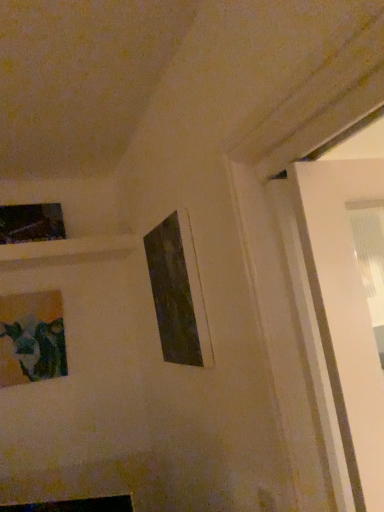
Image resolution: width=384 pixels, height=512 pixels. What are the coordinates of `matte black picture frame at center, placed as the first picture frame when sorted from front to back` in the screenshot? It's located at (178, 292).

What do you see at coordinates (31, 223) in the screenshot? The width and height of the screenshot is (384, 512). I see `matte black picture frame at upper left, acting as the 1th picture frame starting from the back` at bounding box center [31, 223].

In order to face matte black picture frame at upper left, the first picture frame from the left, should I rotate leftwards or rightwards?

Turn left approximately 20.401 degrees to face it.

Find the location of a particular element. matte black picture frame at center, the third picture frame from the back is located at coordinates (178, 292).

From a real-world perspective, who is located higher, matte black picture frame at center, the 3th picture frame positioned from the left, or matte glass picture frame at lower left, the second picture frame from the right?

In real-world perspective, matte black picture frame at center, the 3th picture frame positioned from the left, is above.

In the scene shown: Is matte black picture frame at center, the 3th picture frame positioned from the left, positioned far away from matte glass picture frame at lower left, which is the 2th picture frame from left to right?

No, matte black picture frame at center, the 3th picture frame positioned from the left, is in close proximity to matte glass picture frame at lower left, which is the 2th picture frame from left to right.

In terms of size, does matte black picture frame at center, the first picture frame from the right, appear bigger or smaller than matte glass picture frame at lower left, which is the 2th picture frame from left to right?

In the image, matte black picture frame at center, the first picture frame from the right, appears to be larger than matte glass picture frame at lower left, which is the 2th picture frame from left to right.

Considering the relative positions of matte black picture frame at center, the third picture frame from the back, and matte glass picture frame at lower left, which is the 2th picture frame from left to right, in the image provided, is matte black picture frame at center, the third picture frame from the back, to the left of matte glass picture frame at lower left, which is the 2th picture frame from left to right, from the viewer's perspective?

No.

Is matte black picture frame at upper left, the third picture frame positioned from the front, smaller than matte black picture frame at center, the third picture frame from the back?

Indeed, matte black picture frame at upper left, the third picture frame positioned from the front, has a smaller size compared to matte black picture frame at center, the third picture frame from the back.

Considering the positions of objects matte black picture frame at upper left, acting as the 1th picture frame starting from the back, and matte black picture frame at center, the 3th picture frame positioned from the left, in the image provided, who is more to the right, matte black picture frame at upper left, acting as the 1th picture frame starting from the back, or matte black picture frame at center, the 3th picture frame positioned from the left,?

Positioned to the right is matte black picture frame at center, the 3th picture frame positioned from the left.

Can you tell me how much matte black picture frame at upper left, the first picture frame from the left, and matte black picture frame at center, placed as the first picture frame when sorted from front to back, differ in facing direction?

90.5 degrees separate the facing orientations of matte black picture frame at upper left, the first picture frame from the left, and matte black picture frame at center, placed as the first picture frame when sorted from front to back.

From a real-world perspective, which object rests below the other?

matte black picture frame at center, placed as the first picture frame when sorted from front to back.

Between matte glass picture frame at lower left, which is the 2th picture frame from left to right, and matte black picture frame at upper left, which is the 3th picture frame in right-to-left order, which one has larger width?

matte black picture frame at upper left, which is the 3th picture frame in right-to-left order, is wider.

Is matte glass picture frame at lower left, which is the 2th picture frame from left to right, positioned beyond the bounds of matte black picture frame at upper left, acting as the 1th picture frame starting from the back?

Absolutely, matte glass picture frame at lower left, which is the 2th picture frame from left to right, is external to matte black picture frame at upper left, acting as the 1th picture frame starting from the back.

Does matte glass picture frame at lower left, acting as the second picture frame starting from the back, lie behind matte black picture frame at upper left, which is the 3th picture frame in right-to-left order?

That is False.

Based on their sizes in the image, would you say matte glass picture frame at lower left, the second picture frame from the right, is bigger or smaller than matte black picture frame at upper left, the third picture frame positioned from the front?

matte glass picture frame at lower left, the second picture frame from the right, is bigger than matte black picture frame at upper left, the third picture frame positioned from the front.

Between matte black picture frame at upper left, the third picture frame positioned from the front, and matte glass picture frame at lower left, the second picture frame from the right, which one has larger size?

With larger size is matte glass picture frame at lower left, the second picture frame from the right.

Is matte black picture frame at upper left, the third picture frame positioned from the front, oriented towards matte glass picture frame at lower left, which is counted as the second picture frame, starting from the front?

No, matte black picture frame at upper left, the third picture frame positioned from the front, is not turned towards matte glass picture frame at lower left, which is counted as the second picture frame, starting from the front.

Considering the sizes of matte black picture frame at upper left, the first picture frame from the left, and matte glass picture frame at lower left, which is the 2th picture frame from left to right, in the image, is matte black picture frame at upper left, the first picture frame from the left, taller or shorter than matte glass picture frame at lower left, which is the 2th picture frame from left to right,?

Considering their sizes, matte black picture frame at upper left, the first picture frame from the left, has less height than matte glass picture frame at lower left, which is the 2th picture frame from left to right.

Does matte black picture frame at upper left, the third picture frame positioned from the front, come in front of matte glass picture frame at lower left, the second picture frame from the right?

No, matte black picture frame at upper left, the third picture frame positioned from the front, is further to the viewer.

Between matte glass picture frame at lower left, the second picture frame from the right, and matte black picture frame at center, the third picture frame from the back, which one has smaller width?

Thinner between the two is matte black picture frame at center, the third picture frame from the back.

From the image's perspective, who appears lower, matte glass picture frame at lower left, the second picture frame from the right, or matte black picture frame at center, the 3th picture frame positioned from the left?

matte glass picture frame at lower left, the second picture frame from the right.

Which object is closer to the camera taking this photo, matte glass picture frame at lower left, which is counted as the second picture frame, starting from the front, or matte black picture frame at center, placed as the first picture frame when sorted from front to back?

matte black picture frame at center, placed as the first picture frame when sorted from front to back.

Does matte glass picture frame at lower left, which is the 2th picture frame from left to right, appear on the right side of matte black picture frame at center, the 3th picture frame positioned from the left?

In fact, matte glass picture frame at lower left, which is the 2th picture frame from left to right, is to the left of matte black picture frame at center, the 3th picture frame positioned from the left.

Can you confirm if matte black picture frame at center, the third picture frame from the back, is bigger than matte black picture frame at upper left, acting as the 1th picture frame starting from the back?

Correct, matte black picture frame at center, the third picture frame from the back, is larger in size than matte black picture frame at upper left, acting as the 1th picture frame starting from the back.

Is matte black picture frame at center, the 3th picture frame positioned from the left, further to camera compared to matte black picture frame at upper left, the third picture frame positioned from the front?

No, matte black picture frame at center, the 3th picture frame positioned from the left, is closer to the viewer.

Is matte black picture frame at upper left, the first picture frame from the left, at the back of matte black picture frame at center, the 3th picture frame positioned from the left?

matte black picture frame at center, the 3th picture frame positioned from the left, is not turned away from matte black picture frame at upper left, the first picture frame from the left.

Who is taller, matte black picture frame at center, the 3th picture frame positioned from the left, or matte black picture frame at upper left, the third picture frame positioned from the front?

matte black picture frame at center, the 3th picture frame positioned from the left, is taller.

Locate an element on the screen. picture frame on the right of matte glass picture frame at lower left, which is counted as the second picture frame, starting from the front is located at coordinates (178, 292).

This screenshot has height=512, width=384. Identify the location of the 1st picture frame positioned below the matte black picture frame at upper left, the third picture frame positioned from the front (from the image's perspective). (178, 292).

Estimate the real-world distances between objects in this image. Which object is closer to matte black picture frame at center, the 3th picture frame positioned from the left, matte glass picture frame at lower left, which is counted as the second picture frame, starting from the front, or matte black picture frame at upper left, the third picture frame positioned from the front?

Based on the image, matte glass picture frame at lower left, which is counted as the second picture frame, starting from the front, appears to be nearer to matte black picture frame at center, the 3th picture frame positioned from the left.

Which object lies nearer to the anchor point matte glass picture frame at lower left, which is counted as the second picture frame, starting from the front, matte black picture frame at center, the first picture frame from the right, or matte black picture frame at upper left, which is the 3th picture frame in right-to-left order?

matte black picture frame at upper left, which is the 3th picture frame in right-to-left order.

Looking at the image, which one is located further to matte black picture frame at upper left, the third picture frame positioned from the front, matte black picture frame at center, the 3th picture frame positioned from the left, or matte glass picture frame at lower left, which is the 2th picture frame from left to right?

Based on the image, matte black picture frame at center, the 3th picture frame positioned from the left, appears to be further to matte black picture frame at upper left, the third picture frame positioned from the front.

Looking at the image, which one is located closer to matte glass picture frame at lower left, the second picture frame from the right, matte black picture frame at upper left, the third picture frame positioned from the front, or matte black picture frame at center, placed as the first picture frame when sorted from front to back?

Among the two, matte black picture frame at upper left, the third picture frame positioned from the front, is located nearer to matte glass picture frame at lower left, the second picture frame from the right.

When comparing their distances from matte black picture frame at upper left, the first picture frame from the left, does matte glass picture frame at lower left, the second picture frame from the right, or matte black picture frame at center, the 3th picture frame positioned from the left, seem closer?

matte glass picture frame at lower left, the second picture frame from the right, lies closer to matte black picture frame at upper left, the first picture frame from the left, than the other object.

When comparing their distances from matte black picture frame at center, the third picture frame from the back, does matte black picture frame at upper left, acting as the 1th picture frame starting from the back, or matte glass picture frame at lower left, which is counted as the second picture frame, starting from the front, seem further?

The object further to matte black picture frame at center, the third picture frame from the back, is matte black picture frame at upper left, acting as the 1th picture frame starting from the back.

What are the coordinates of `picture frame between matte black picture frame at upper left, the first picture frame from the left, and matte black picture frame at center, placed as the first picture frame when sorted from front to back, from left to right` in the screenshot? It's located at (32, 338).